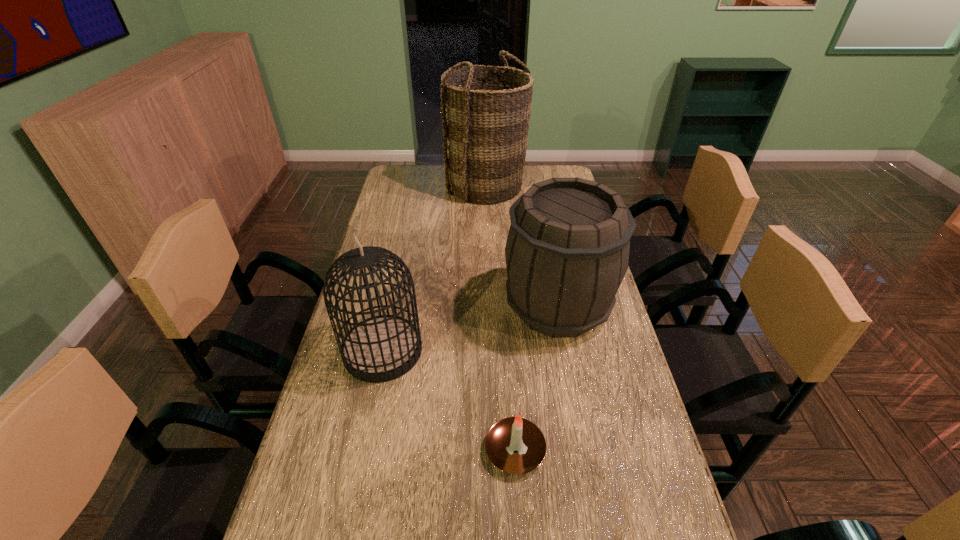
Find the location of a particular element. the second closest object to the leftmost object is located at coordinates (567, 251).

Image resolution: width=960 pixels, height=540 pixels. In order to click on vacant region that satisfies the following two spatial constraints: 1. on the front side of the shortest object; 2. on the right side of the leftmost object in this screenshot , I will do `click(362, 450)`.

Image resolution: width=960 pixels, height=540 pixels. What are the coordinates of `vacant space that satisfies the following two spatial constraints: 1. on the back side of the leftmost object; 2. on the left side of the wine bucket` in the screenshot? It's located at tap(392, 306).